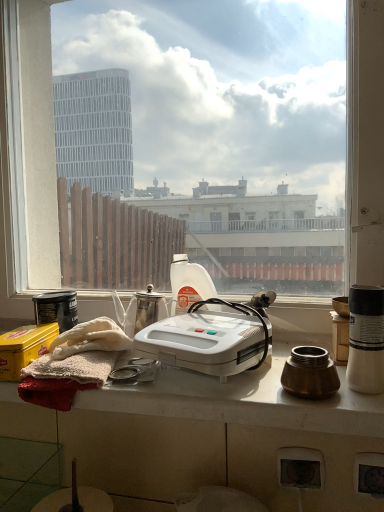
Question: From the image's perspective, is white glossy table at center over white plastic bottle at center?

Choices:
 (A) no
 (B) yes

Answer: (A)

Question: From a real-world perspective, is white glossy table at center positioned under white plastic bottle at center based on gravity?

Choices:
 (A) no
 (B) yes

Answer: (B)

Question: Is white glossy table at center to the right of white plastic bottle at center from the viewer's perspective?

Choices:
 (A) yes
 (B) no

Answer: (B)

Question: Is white glossy table at center thinner than white plastic bottle at center?

Choices:
 (A) no
 (B) yes

Answer: (A)

Question: Is white glossy table at center beside white plastic bottle at center?

Choices:
 (A) yes
 (B) no

Answer: (B)

Question: Is white glossy table at center aimed at white plastic bottle at center?

Choices:
 (A) yes
 (B) no

Answer: (B)

Question: From the image's perspective, does matte black canister at left, which is counted as the 2th appliance, starting from the front, appear higher than transparent glass window at center?

Choices:
 (A) yes
 (B) no

Answer: (B)

Question: Is matte black canister at left, marked as the 2th appliance in a back-to-front arrangement, next to transparent glass window at center?

Choices:
 (A) no
 (B) yes

Answer: (A)

Question: From a real-world perspective, does matte black canister at left, which is counted as the 2th appliance, starting from the front, stand above transparent glass window at center?

Choices:
 (A) no
 (B) yes

Answer: (A)

Question: Is matte black canister at left, which is counted as the 2th appliance, starting from the front, oriented towards transparent glass window at center?

Choices:
 (A) yes
 (B) no

Answer: (B)

Question: Does matte black canister at left, the 1th appliance viewed from the left, have a greater height compared to transparent glass window at center?

Choices:
 (A) no
 (B) yes

Answer: (A)

Question: Is matte black canister at left, the 1th appliance viewed from the left, completely or partially outside of transparent glass window at center?

Choices:
 (A) no
 (B) yes

Answer: (B)

Question: Is yellow matte tin at lower left oriented away from white plastic waffle maker at center?

Choices:
 (A) no
 (B) yes

Answer: (A)